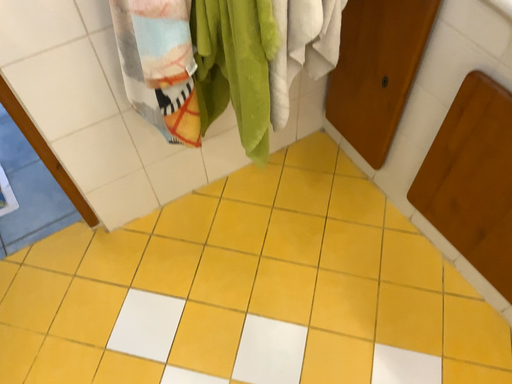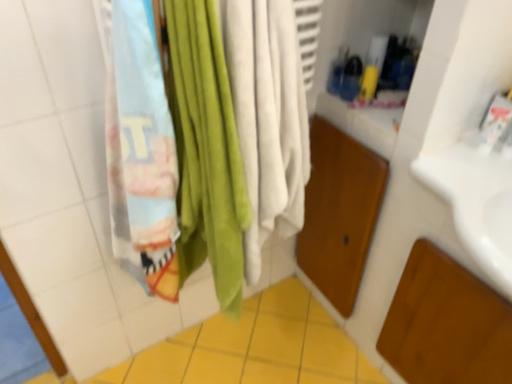
Question: How did the camera likely rotate when shooting the video?

Choices:
 (A) rotated upward
 (B) rotated downward

Answer: (A)